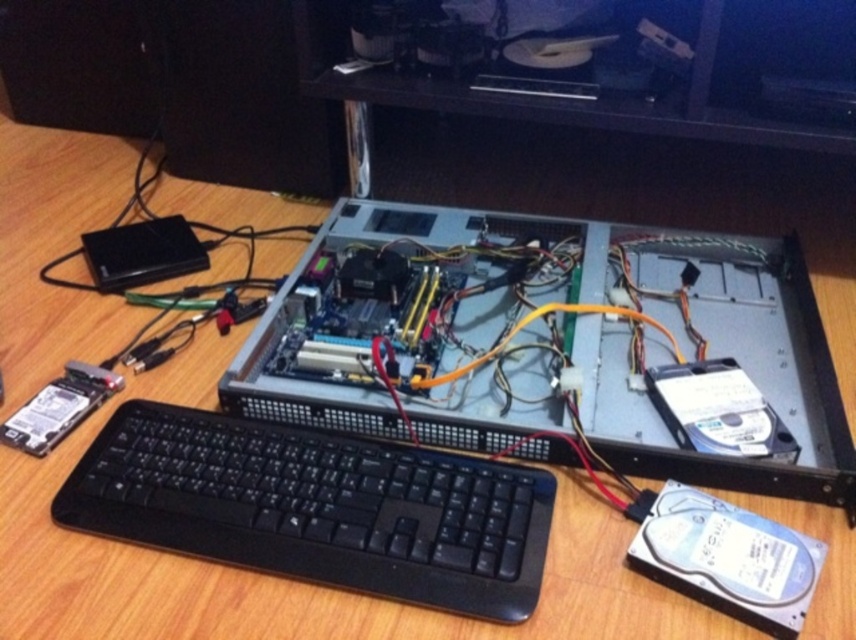
You are setting up a computer desk. You have a silver metallic computer at center and a black plastic keyboard at lower left. Where is the silver metallic computer located relative to the black plastic keyboard?

The silver metallic computer at center is above the black plastic keyboard at lower left.

You are setting up a computer workstation and need to place the silver metallic computer at center and the black plastic keyboard at lower left. Based on their positions, which object is closer to you as you face the desk?

The silver metallic computer at center is closer to you because it is positioned further to the viewer than the black plastic keyboard at lower left, meaning it occupies a more forward spatial plane in the setup.